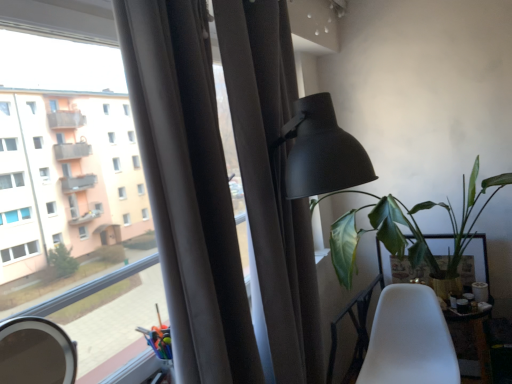
Question: Can you confirm if green leafy plant at right is positioned to the right of white matte chair at lower right?

Choices:
 (A) no
 (B) yes

Answer: (B)

Question: Considering the relative sizes of green leafy plant at right and white matte chair at lower right in the image provided, is green leafy plant at right bigger than white matte chair at lower right?

Choices:
 (A) no
 (B) yes

Answer: (B)

Question: Considering the relative sizes of green leafy plant at right and white matte chair at lower right in the image provided, is green leafy plant at right wider than white matte chair at lower right?

Choices:
 (A) no
 (B) yes

Answer: (B)

Question: Are green leafy plant at right and white matte chair at lower right beside each other?

Choices:
 (A) no
 (B) yes

Answer: (A)

Question: Does green leafy plant at right have a smaller size compared to white matte chair at lower right?

Choices:
 (A) no
 (B) yes

Answer: (A)

Question: Is green leafy plant at right positioned beyond the bounds of white matte chair at lower right?

Choices:
 (A) yes
 (B) no

Answer: (A)

Question: Can we say white matte chair at lower right lies outside matte gray curtain at center?

Choices:
 (A) yes
 (B) no

Answer: (A)

Question: Does white matte chair at lower right come in front of matte gray curtain at center?

Choices:
 (A) yes
 (B) no

Answer: (B)

Question: Is white matte chair at lower right not near matte gray curtain at center?

Choices:
 (A) yes
 (B) no

Answer: (B)

Question: Does white matte chair at lower right have a smaller size compared to matte gray curtain at center?

Choices:
 (A) yes
 (B) no

Answer: (A)

Question: Would you say matte gray curtain at center is part of white matte chair at lower right's contents?

Choices:
 (A) no
 (B) yes

Answer: (A)

Question: Is white matte chair at lower right oriented away from matte gray curtain at center?

Choices:
 (A) yes
 (B) no

Answer: (B)

Question: From a real-world perspective, is wooden table at lower right, which is the 2th table from back to front, positioned under matte black lamp at upper right based on gravity?

Choices:
 (A) no
 (B) yes

Answer: (B)